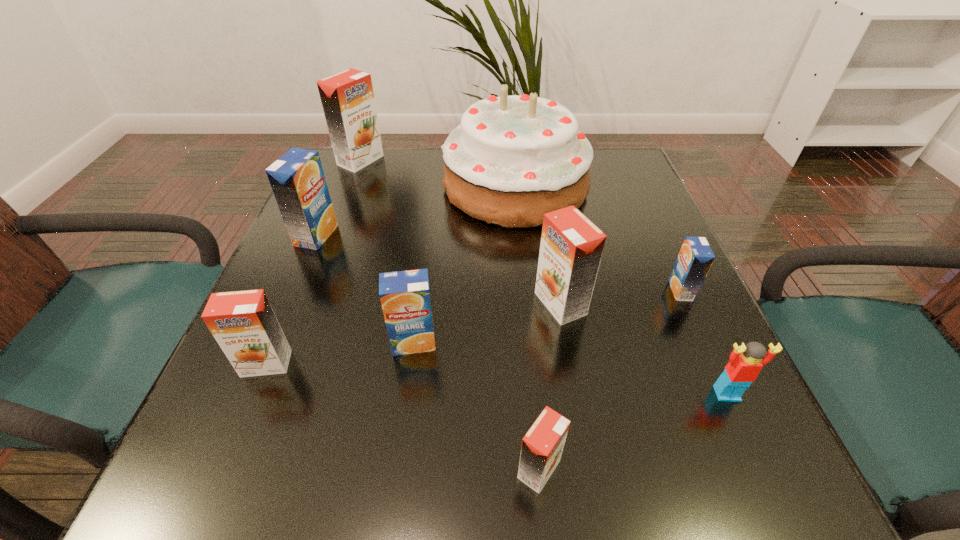
Locate which blue orange_juice ranks second in proximity to the rightmost blue orange_juice. Please provide its 2D coordinates. Your answer should be formatted as a tuple, i.e. [(x, y)], where the tuple contains the x and y coordinates of a point satisfying the conditions above.

[(297, 179)]

The width and height of the screenshot is (960, 540). What are the coordinates of `vacant point that satisfies the following two spatial constraints: 1. on the back side of the red cake; 2. on the right side of the second biggest blue orange_juice` in the screenshot? It's located at (435, 186).